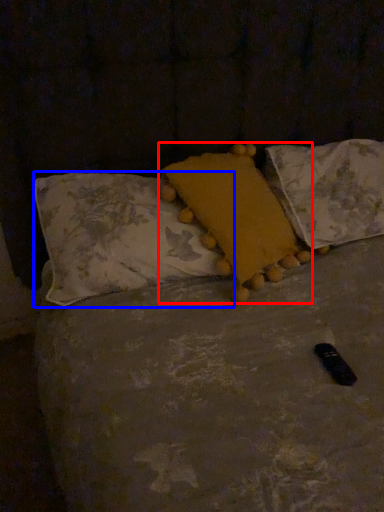
Question: Which object is further to the camera taking this photo, pillow (highlighted by a red box) or pillow (highlighted by a blue box)?

Choices:
 (A) pillow
 (B) pillow

Answer: (A)